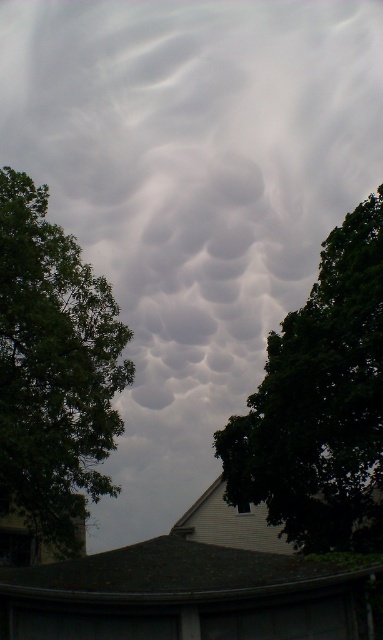
Between green leafy tree at center and green leafy tree at left, which one is positioned higher?

green leafy tree at left is higher up.

Measure the distance between green leafy tree at center and camera.

They are 22.14 meters apart.

Where is `green leafy tree at center`? This screenshot has width=383, height=640. green leafy tree at center is located at coordinates (320, 403).